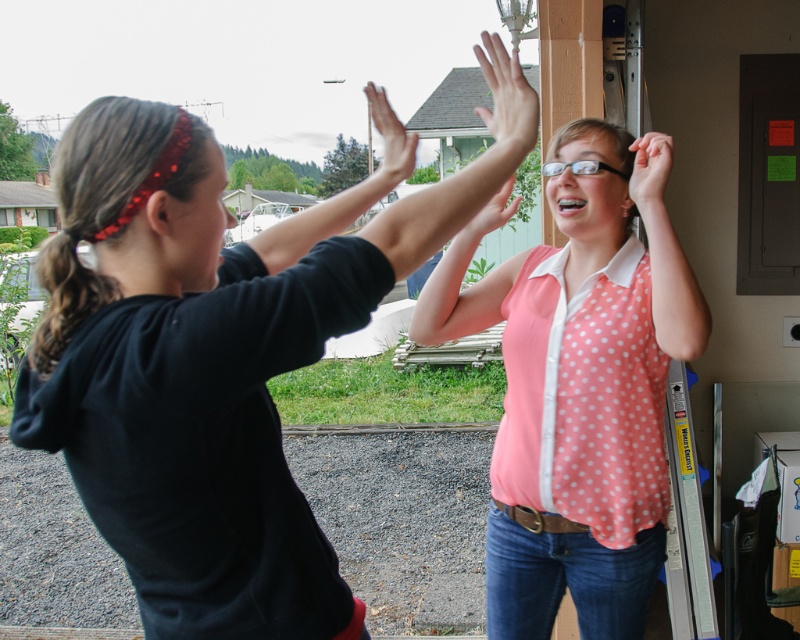
You are a photographer adjusting the camera focus. The matte black hand at center and the pink polka dot shirt at upper center are both in the frame. Which object should you focus on first if you want to ensure the larger object is sharp?

The matte black hand at center should be focused on first because its width is larger than the pink polka dot shirt at upper center, making it the larger object in the frame.

You are a photographer trying to capture a clear shot of both the pink polka dot sleeve at upper center and the matte pink shirt at upper right. Based on their positions, which one will appear larger in your photo?

The pink polka dot sleeve at upper center will appear larger in the photo because it is closer to the viewer than the matte pink shirt at upper right.

You are a photographer trying to capture a candid shot of the two people in the scene. The camera you are using has a minimum focusing distance of 3 feet. Can you take a clear photo of both the pink polka dot sleeve at upper center and the matte black hand at center without moving the subjects?

The pink polka dot sleeve at upper center is 3.91 feet from the matte black hand at center. Since the minimum focusing distance of the camera is 3 feet, the distance between them is sufficient for the camera to focus on both subjects without needing to move them.